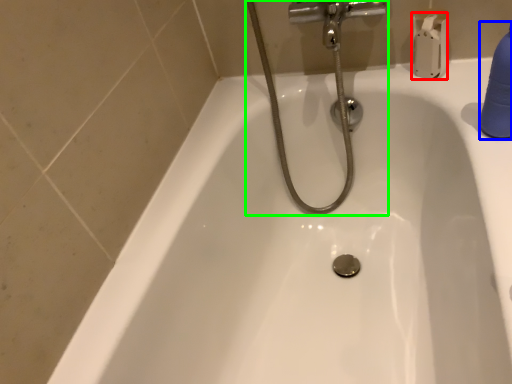
Question: Which object is positioned farthest from toilet paper (highlighted by a red box)? Select from cleaning product (highlighted by a blue box) and plumbing fixture (highlighted by a green box).

Choices:
 (A) cleaning product
 (B) plumbing fixture

Answer: (A)